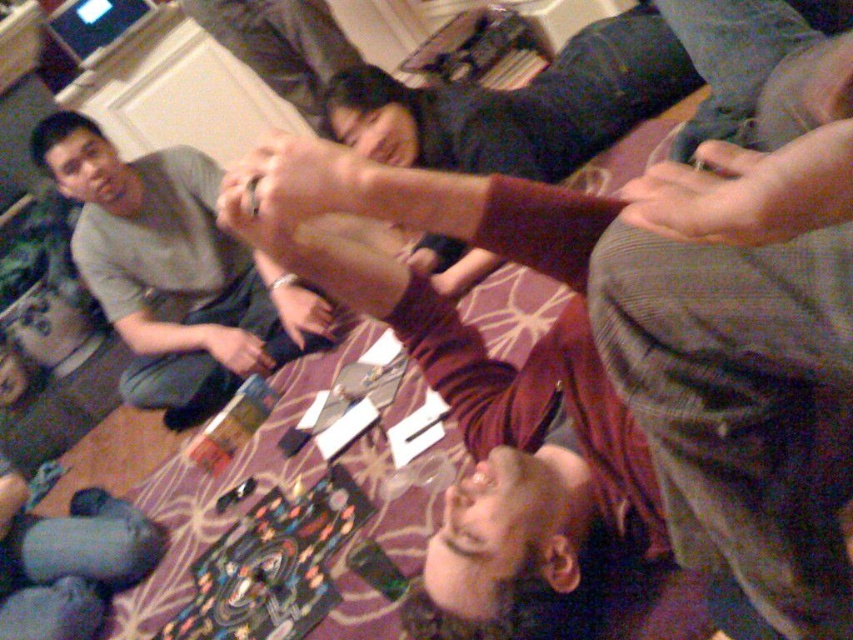
You are organizing a small gathering and need to place a 30 inch wide decorative panel between the gray cotton shirt at upper left and the dark gray sweater at upper center. Can you fit it there?

The distance between the gray cotton shirt at upper left and the dark gray sweater at upper center is 29.95 inches, so the 30 inch wide decorative panel cannot fit as it is slightly wider than the available space.